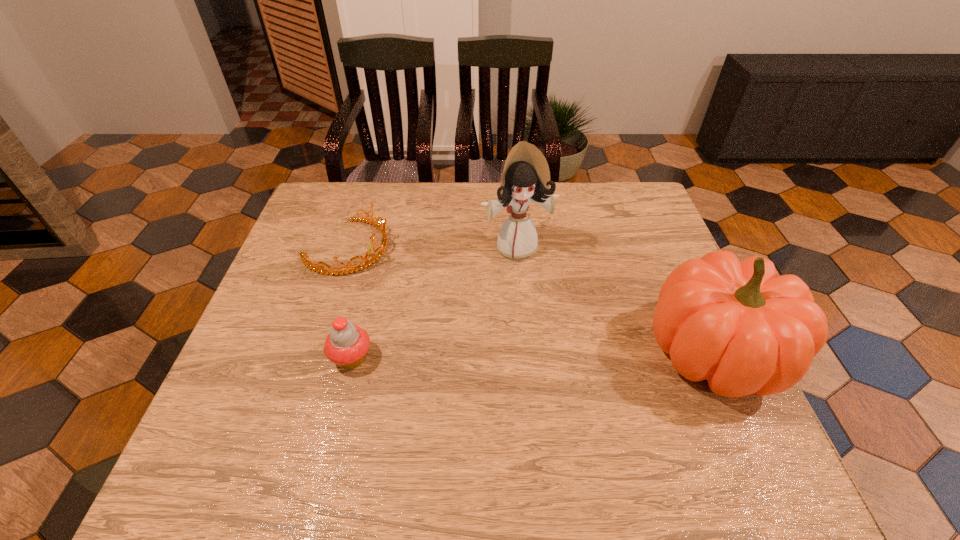
Where is `vacant space situated 0.070m on the front-facing side of the tiara`? vacant space situated 0.070m on the front-facing side of the tiara is located at coordinates (397, 274).

Identify the location of object situated at the far edge. (350, 268).

Where is `object present at the near edge`? The width and height of the screenshot is (960, 540). object present at the near edge is located at coordinates (737, 324).

This screenshot has height=540, width=960. What are the coordinates of `object at the left edge` in the screenshot? It's located at (350, 268).

This screenshot has height=540, width=960. Find the location of `object present at the right edge`. object present at the right edge is located at coordinates click(737, 324).

Locate an element on the screen. object at the far left corner is located at coordinates (350, 268).

I want to click on object present at the near right corner, so click(x=737, y=324).

You are a GUI agent. You are given a task and a screenshot of the screen. Output one action in this format:
    pyautogui.click(x=<x>, y=<y>)
    Task: Click on the vacant area at the far edge of the desktop
    This screenshot has height=540, width=960.
    Given the screenshot: What is the action you would take?
    pyautogui.click(x=365, y=205)

In order to click on vacant space at the near edge of the desktop in this screenshot , I will do `click(447, 423)`.

Where is `free space at the left edge`? The image size is (960, 540). free space at the left edge is located at coordinates (291, 275).